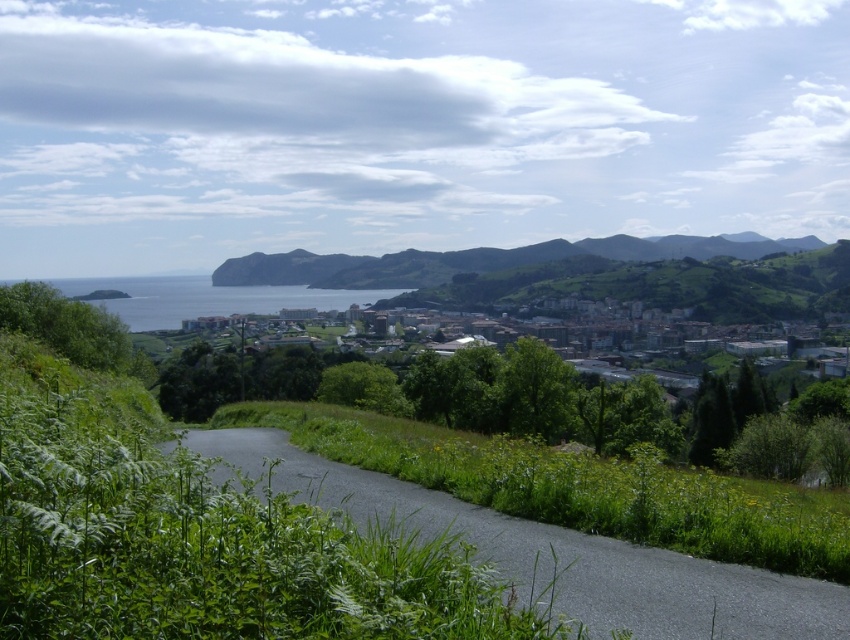
Question: Is asphalt road at center further to camera compared to brown stone buildings at center?

Choices:
 (A) yes
 (B) no

Answer: (B)

Question: Can you confirm if asphalt road at center is positioned to the left of brown stone buildings at center?

Choices:
 (A) yes
 (B) no

Answer: (A)

Question: Which of the following is the closest to the observer?

Choices:
 (A) (590, 564)
 (B) (667, 337)

Answer: (A)

Question: Which object appears farthest from the camera in this image?

Choices:
 (A) asphalt road at center
 (B) brown stone buildings at center

Answer: (B)

Question: Which point is closer to the camera?

Choices:
 (A) (287, 474)
 (B) (285, 298)

Answer: (A)

Question: Is asphalt road at center below brown stone buildings at center?

Choices:
 (A) yes
 (B) no

Answer: (A)